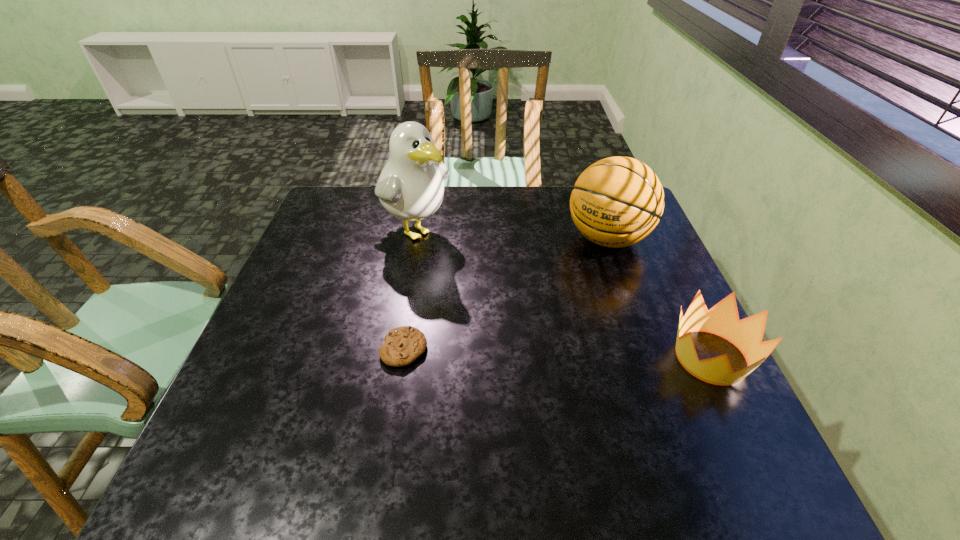
The image size is (960, 540). What are the coordinates of `vacant region at the right edge` in the screenshot? It's located at (671, 354).

Where is `vacant region at the far left corner of the desktop`? vacant region at the far left corner of the desktop is located at coordinates (346, 191).

You are a GUI agent. You are given a task and a screenshot of the screen. Output one action in this format:
    pyautogui.click(x=<x>, y=<y>)
    Task: Click on the vacant region at the near left corner
    
    Given the screenshot: What is the action you would take?
    pyautogui.click(x=228, y=411)

The image size is (960, 540). I want to click on vacant point located between the crown and the cookie, so click(x=558, y=353).

Identify the location of unoccupied position between the basketball and the third tallest object. The image size is (960, 540). (660, 298).

Where is `vacant space in between the third shortest object and the tallest object`? vacant space in between the third shortest object and the tallest object is located at coordinates (511, 233).

This screenshot has width=960, height=540. In order to click on blank region between the tallest object and the crown in this screenshot , I will do `click(563, 293)`.

Where is `vacant space that's between the third shortest object and the second shortest object`? Image resolution: width=960 pixels, height=540 pixels. vacant space that's between the third shortest object and the second shortest object is located at coordinates (660, 298).

You are a GUI agent. You are given a task and a screenshot of the screen. Output one action in this format:
    pyautogui.click(x=<x>, y=<y>)
    Task: Click on the vacant space that is in between the second shortest object and the tallest object
    Image resolution: width=960 pixels, height=540 pixels.
    Given the screenshot: What is the action you would take?
    pyautogui.click(x=563, y=293)

The height and width of the screenshot is (540, 960). In order to click on free space between the cookie and the second shortest object in this screenshot , I will do `click(558, 353)`.